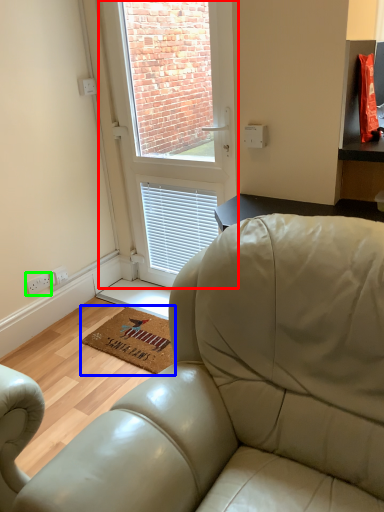
Question: Based on their relative distances, which object is nearer to window (highlighted by a red box)? Choose from mat (highlighted by a blue box) and electric outlet (highlighted by a green box).

Choices:
 (A) mat
 (B) electric outlet

Answer: (A)